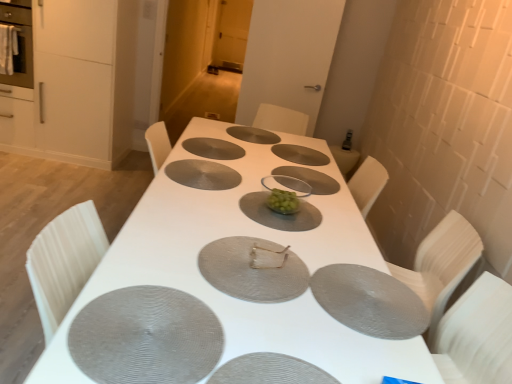
Identify the location of vacant area that lies between matte gray pizza pan at center, which appears as the sixth pizza pan when viewed from the front, and silver textured pizza pan at center, the eighth pizza pan when ordered from front to back. (242, 142).